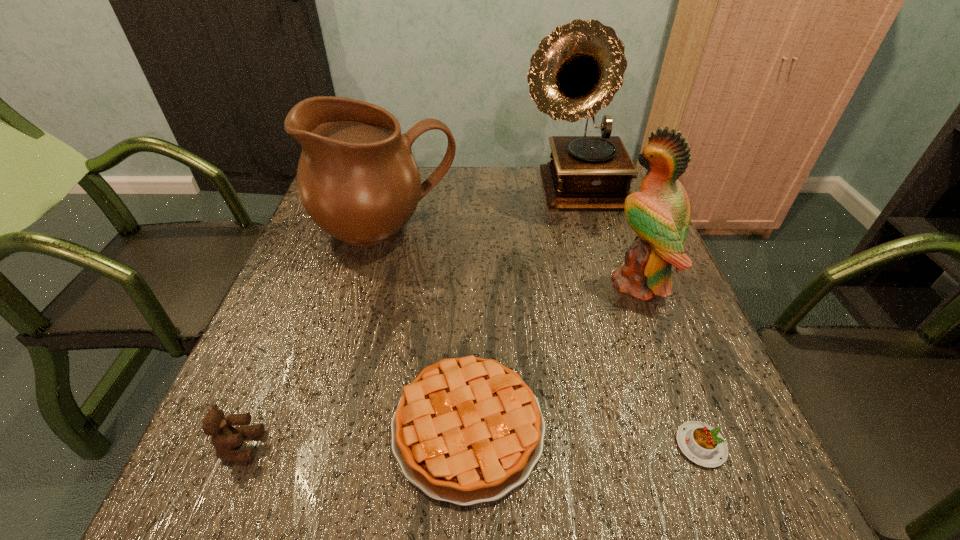
At what (x,y) coordinates should I click in order to perform the action: click on the tallest object. Please return your answer as a coordinate pair (x, y). Looking at the image, I should click on (576, 71).

The height and width of the screenshot is (540, 960). I want to click on parrot, so click(659, 214).

Find the location of a particular element. Image resolution: width=960 pixels, height=540 pixels. cream pitcher is located at coordinates (357, 178).

The image size is (960, 540). Find the location of `the third shortest object`. the third shortest object is located at coordinates (225, 437).

Locate an element on the screen. This screenshot has width=960, height=540. the fifth tallest object is located at coordinates (467, 430).

Locate an element on the screen. the shortest object is located at coordinates (704, 445).

What are the coordinates of `free spot located on the horn of the tallest object` in the screenshot? It's located at (612, 308).

Where is `vacant area situated 0.330m on the front-facing side of the parrot`? This screenshot has width=960, height=540. vacant area situated 0.330m on the front-facing side of the parrot is located at coordinates (464, 283).

Where is `free space located 0.260m on the front-facing side of the parrot`? This screenshot has width=960, height=540. free space located 0.260m on the front-facing side of the parrot is located at coordinates (494, 283).

Image resolution: width=960 pixels, height=540 pixels. I want to click on vacant space located on the front-facing side of the parrot, so click(x=482, y=283).